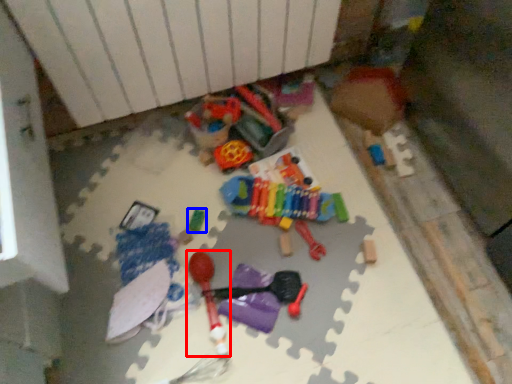
Question: Which of the following is the farthest to the observer, toy (highlighted by a red box) or toy (highlighted by a blue box)?

Choices:
 (A) toy
 (B) toy

Answer: (B)